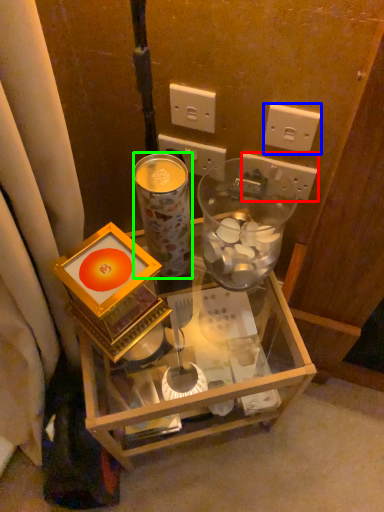
Question: Which is farther away from power outlet (highlighted by a red box)? power outlet (highlighted by a blue box) or coffee cup (highlighted by a green box)?

Choices:
 (A) power outlet
 (B) coffee cup

Answer: (B)